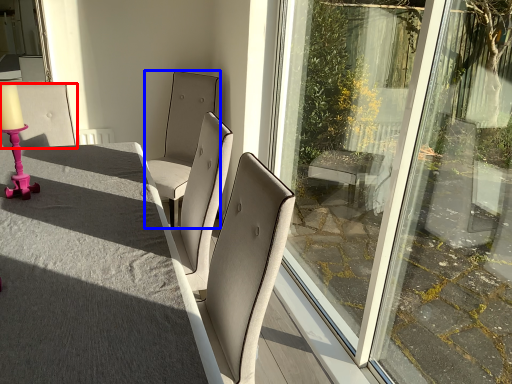
Question: Which object appears farthest to the camera in this image, chair (highlighted by a red box) or chair (highlighted by a blue box)?

Choices:
 (A) chair
 (B) chair

Answer: (B)